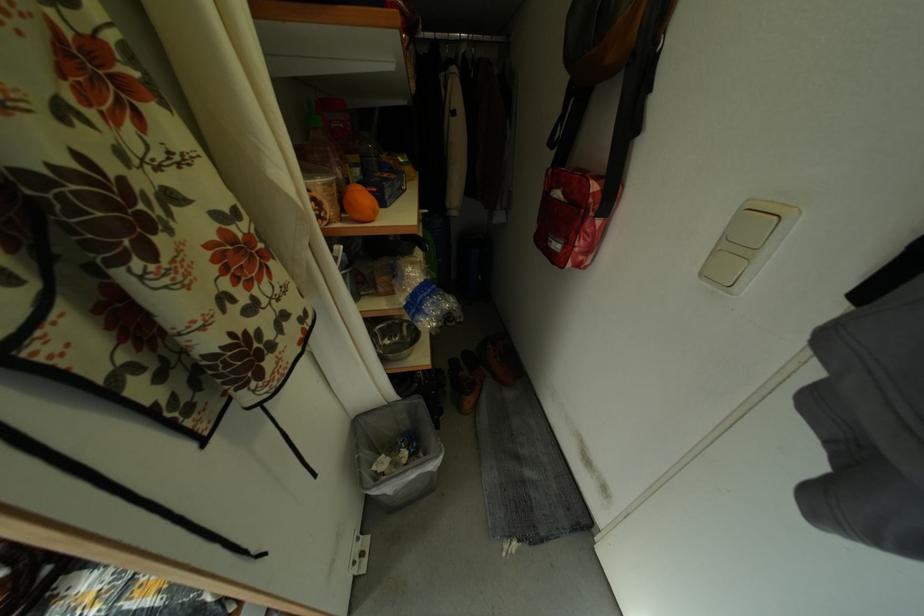
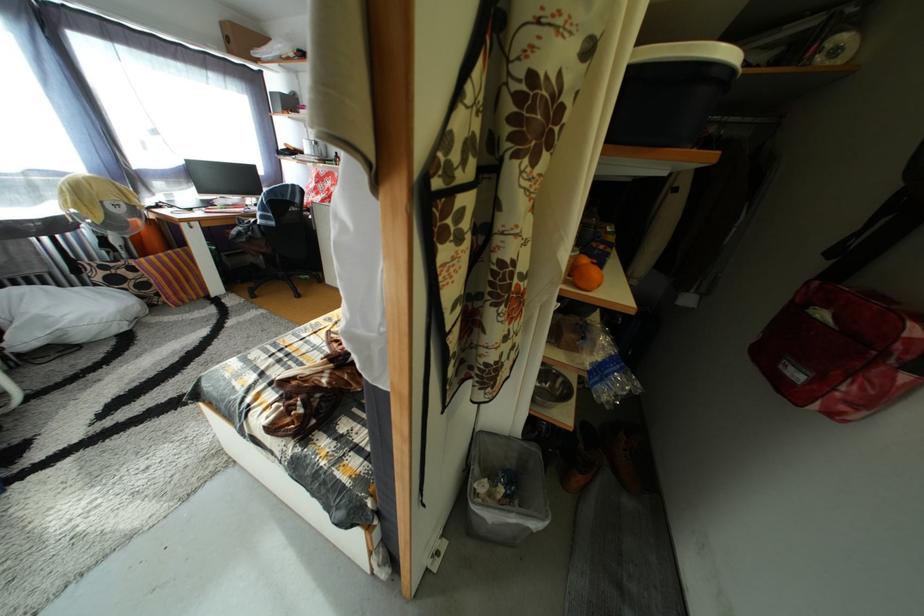
Question: The camera is either moving clockwise (left) or counter-clockwise (right) around the object. The first image is from the beginning of the video and the second image is from the end. Is the camera moving left or right when shooting the video?

Choices:
 (A) Left
 (B) Right

Answer: (B)